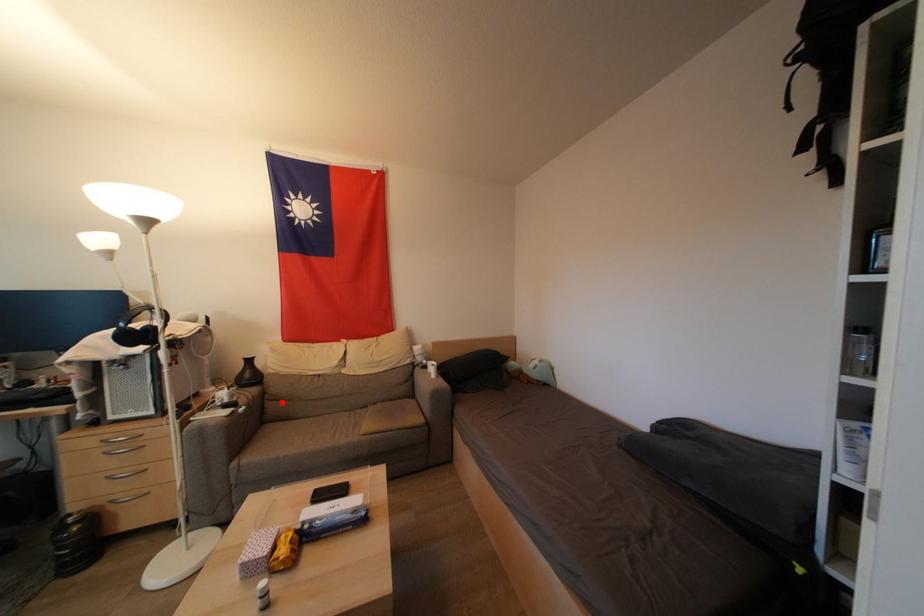
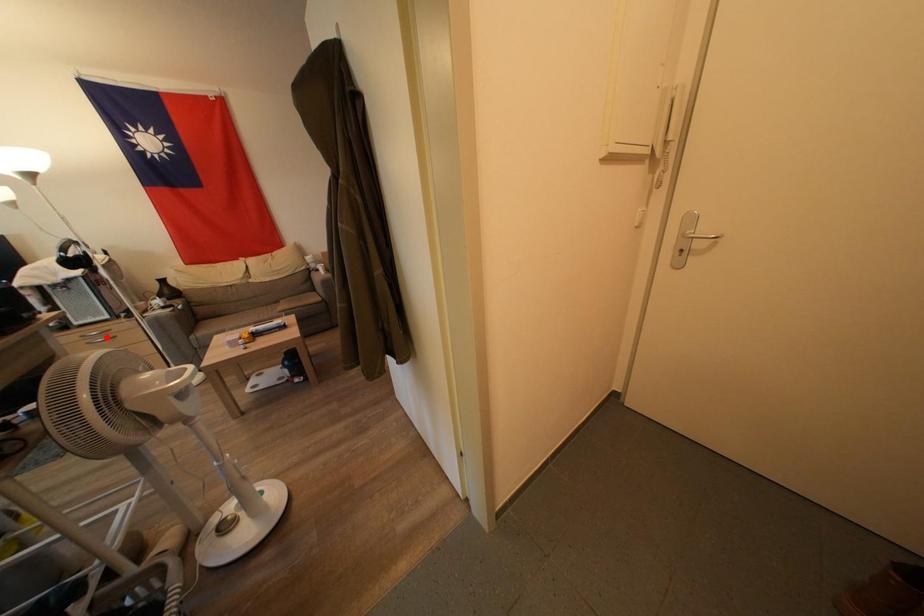
I am providing you with two images of the same scene from different viewpoints. A red point is marked on the first image and another point is marked on the second image. Do the highlighted points in image1 and image2 indicate the same real-world spot?

No